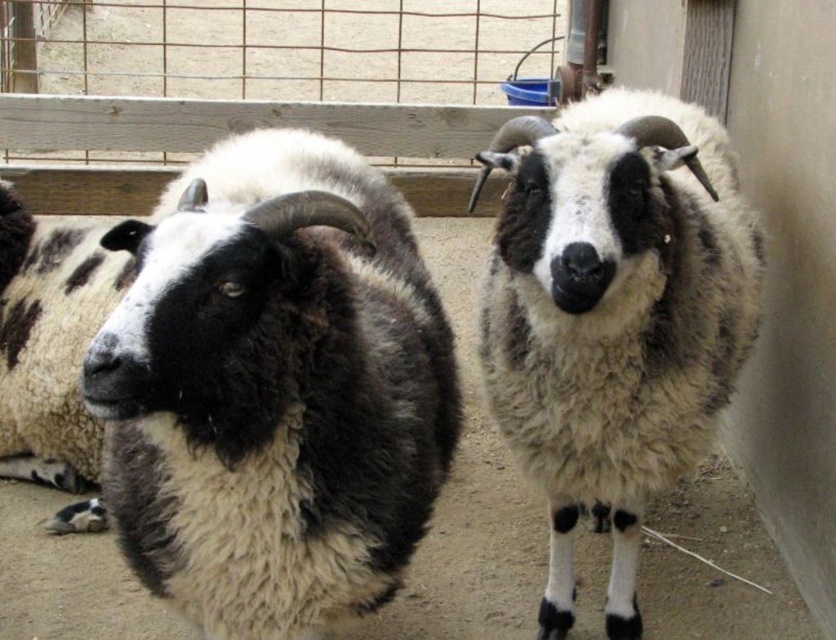
Question: Is fluffy woolen sheep at center to the right of fluffy white wool at left from the viewer's perspective?

Choices:
 (A) no
 (B) yes

Answer: (B)

Question: Which of these objects is positioned farthest from the black and white woolen goat at center?

Choices:
 (A) fluffy woolen sheep at center
 (B) fluffy white wool at left

Answer: (B)

Question: Is black and white woolen goat at center closer to the viewer compared to fluffy white wool at left?

Choices:
 (A) yes
 (B) no

Answer: (A)

Question: Which of these objects is positioned closest to the black and white woolen goat at center?

Choices:
 (A) fluffy white wool at left
 (B) fluffy woolen sheep at center

Answer: (B)

Question: Does fluffy woolen sheep at center come behind fluffy white wool at left?

Choices:
 (A) no
 (B) yes

Answer: (A)

Question: Estimate the real-world distances between objects in this image. Which object is farther from the fluffy woolen sheep at center?

Choices:
 (A) black and white woolen goat at center
 (B) fluffy white wool at left

Answer: (B)